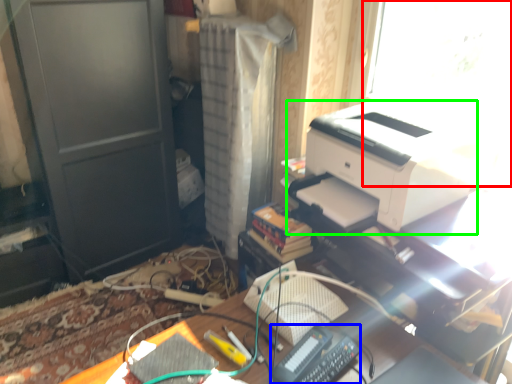
Question: Estimate the real-world distances between objects in this image. Which object is farther from window screen (highlighted by a red box), equipment (highlighted by a blue box) or printer (highlighted by a green box)?

Choices:
 (A) equipment
 (B) printer

Answer: (A)